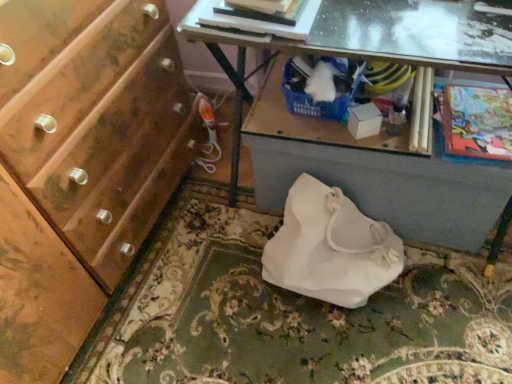
Where is `free space above white fabric bag at lower center (from a real-world perspective)`? This screenshot has width=512, height=384. free space above white fabric bag at lower center (from a real-world perspective) is located at coordinates (295, 304).